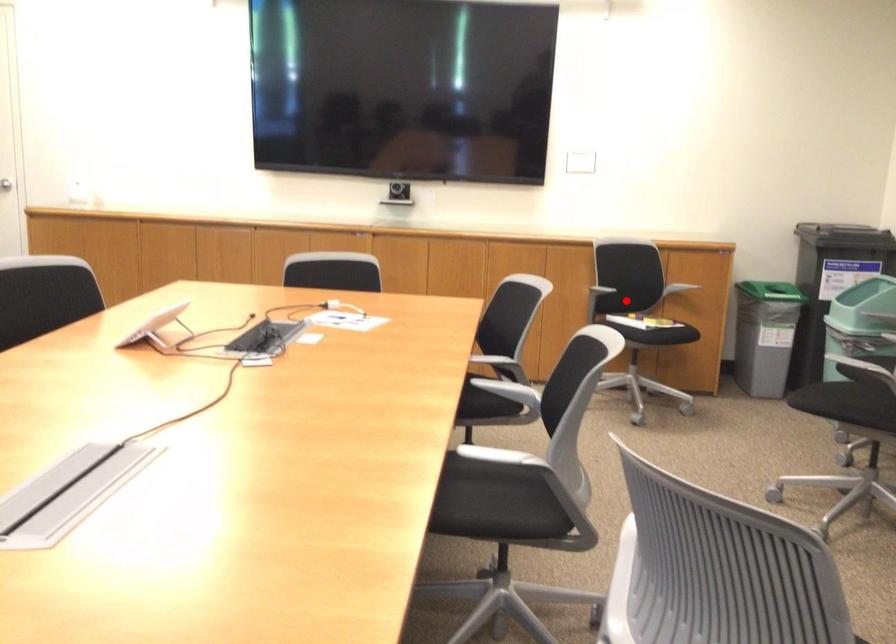
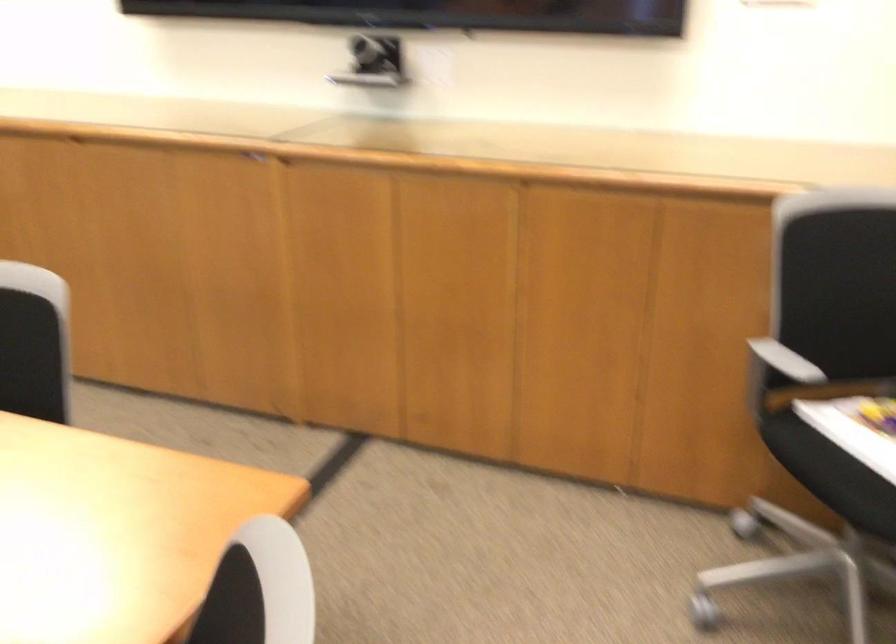
Question: I am providing you with two images of the same scene from different viewpoints. Image1 has a red point marked. In image2, the corresponding 3D location appears at what relative position? Reply with the corresponding letter.

Choices:
 (A) Closer
 (B) Farther

Answer: (A)